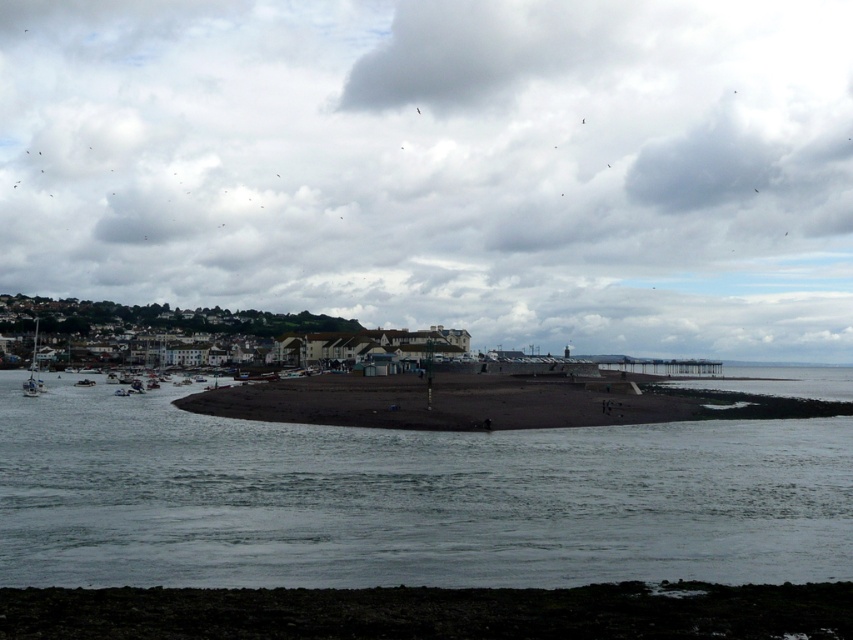
Is point (665, 298) more distant than point (62, 620)?

Yes, point (665, 298) is farther from viewer.

Does cloudy sky at upper center appear on the right side of dark sand at lower center?

In fact, cloudy sky at upper center is to the left of dark sand at lower center.

Find the location of a particular element. cloudy sky at upper center is located at coordinates (444, 166).

Identify the location of cloudy sky at upper center. Image resolution: width=853 pixels, height=640 pixels. (444, 166).

Between point (787, 116) and point (279, 512), which one is positioned in front?

Point (279, 512)

Is cloudy sky at upper center bigger than dark gray water at center?

Indeed, cloudy sky at upper center has a larger size compared to dark gray water at center.

Between point (490, 13) and point (268, 545), which one is positioned in front?

Positioned in front is point (268, 545).

Find the location of a particular element. The image size is (853, 640). cloudy sky at upper center is located at coordinates (444, 166).

In the scene shown: Who is positioned more to the right, dark sand at lower center or dark sand beach at center?

dark sand beach at center

Is dark sand at lower center behind dark sand beach at center?

No, dark sand at lower center is closer to the viewer.

Is point (846, 592) positioned behind point (639, 392)?

No, it is not.

Where is `dark sand at lower center`? Image resolution: width=853 pixels, height=640 pixels. dark sand at lower center is located at coordinates (433, 612).